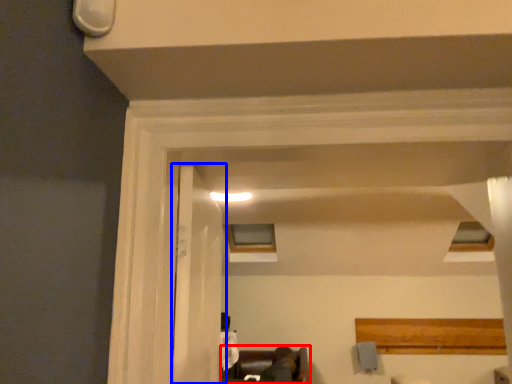
Question: Which point is further to the camera, furniture (highlighted by a red box) or door (highlighted by a blue box)?

Choices:
 (A) furniture
 (B) door

Answer: (A)